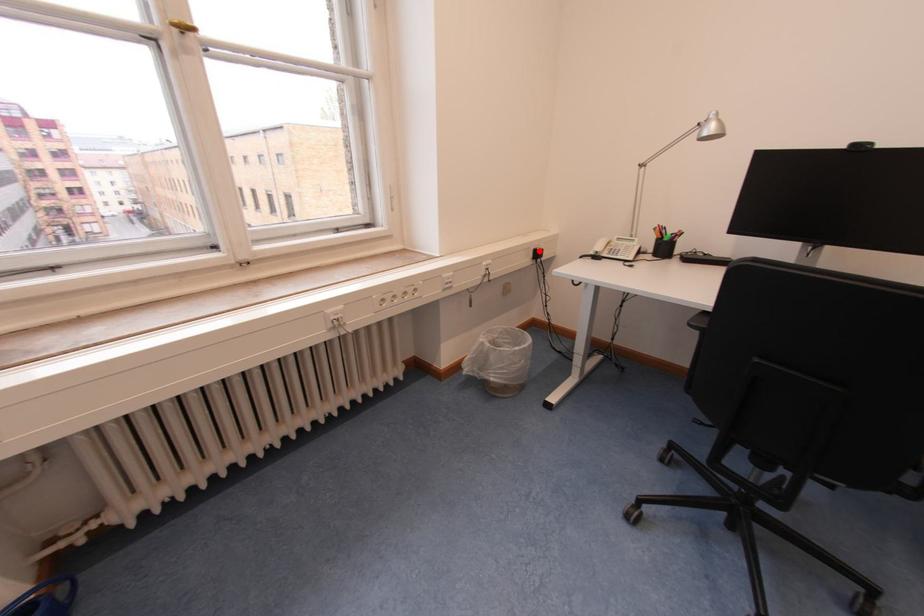
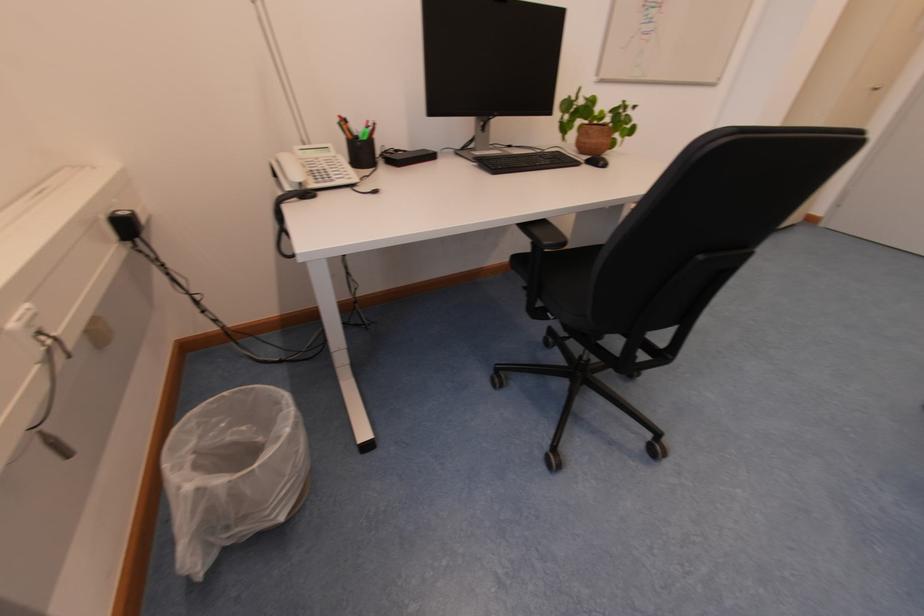
Question: I am providing you with two images of the same scene from different viewpoints. Given a red point in image1, look at the same physical point in image2. Is it:

Choices:
 (A) Closer to the viewpoint
 (B) Farther from the viewpoint

Answer: (B)